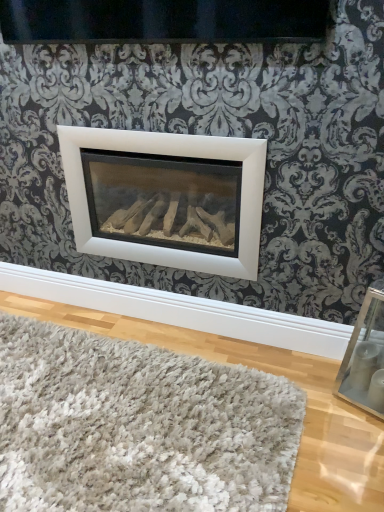
I want to click on free space above white shaggy rug at lower center (from a real-world perspective), so click(93, 410).